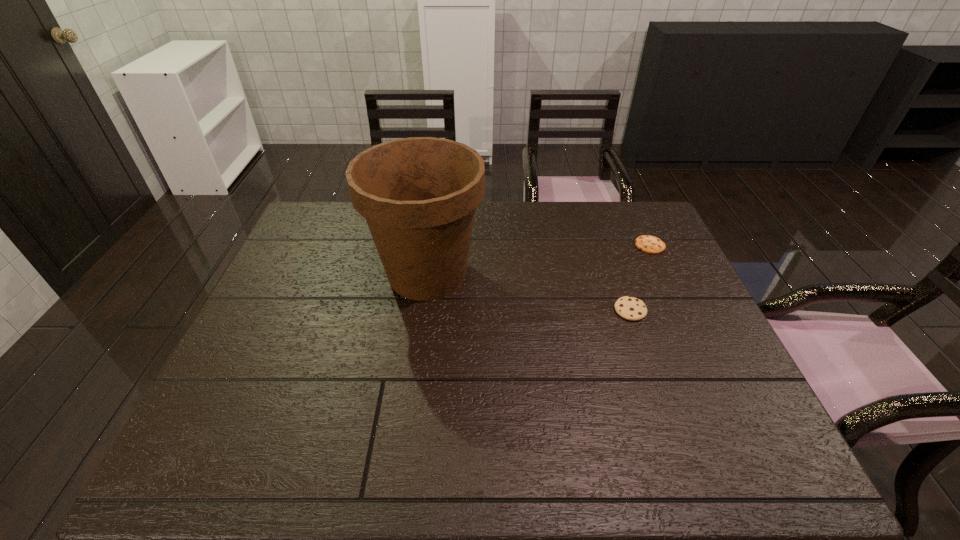
You are a GUI agent. You are given a task and a screenshot of the screen. Output one action in this format:
    pyautogui.click(x=<x>, y=<y>)
    Task: Click on the flowerpot
    The width and height of the screenshot is (960, 540).
    Given the screenshot: What is the action you would take?
    pyautogui.click(x=418, y=195)

The height and width of the screenshot is (540, 960). What are the coordinates of `the leftmost object` in the screenshot? It's located at (418, 195).

Image resolution: width=960 pixels, height=540 pixels. Find the location of `the nearer cookie`. the nearer cookie is located at coordinates (630, 308).

This screenshot has height=540, width=960. What are the coordinates of `the second tallest object` in the screenshot? It's located at (630, 308).

Locate an element on the screen. This screenshot has width=960, height=540. the right cookie is located at coordinates (649, 244).

The width and height of the screenshot is (960, 540). What are the coordinates of `the shorter cookie` in the screenshot? It's located at (649, 244).

Find the location of `free space located 0.360m on the right of the flowerpot`. free space located 0.360m on the right of the flowerpot is located at coordinates (605, 274).

Find the location of `vacant space located 0.290m on the left of the second object from right to left`. vacant space located 0.290m on the left of the second object from right to left is located at coordinates (508, 310).

Locate an element on the screen. vacant area situated 0.190m on the left of the rightmost object is located at coordinates (576, 246).

At what (x,y) coordinates should I click in order to perform the action: click on flowerpot present at the far edge. Please return your answer as a coordinate pair (x, y). This screenshot has width=960, height=540. Looking at the image, I should click on 418,195.